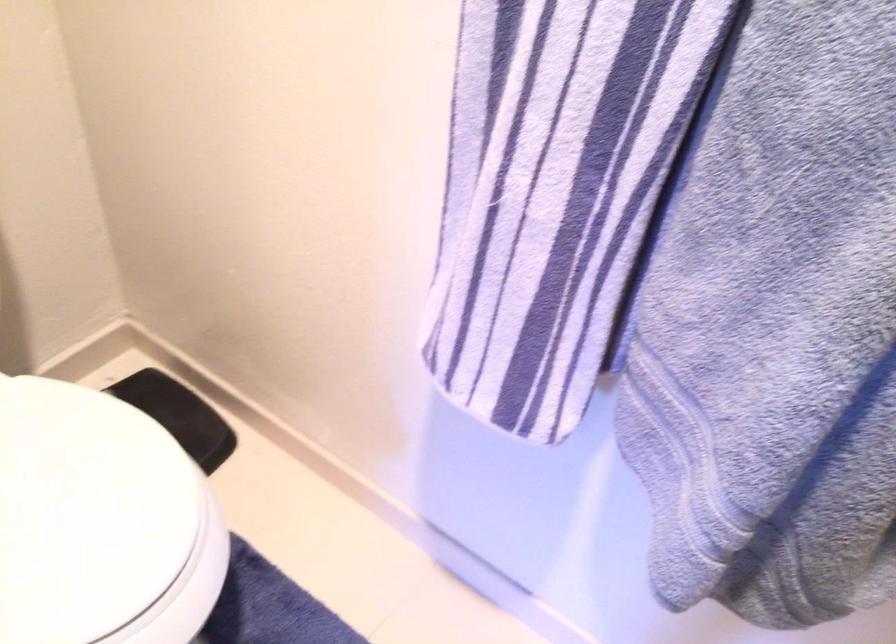
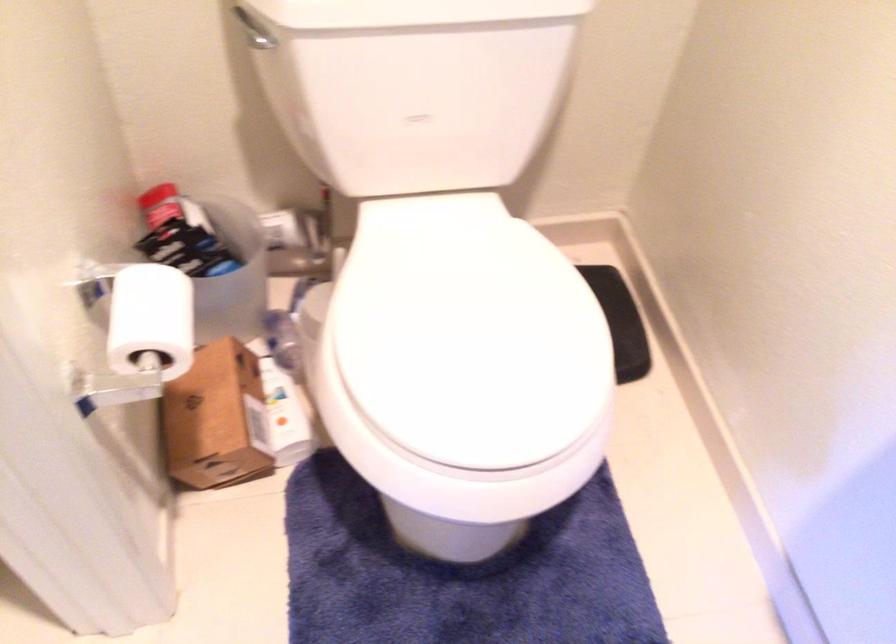
Question: The images are taken continuously from a first-person perspective. In which direction is your viewpoint rotating?

Choices:
 (A) Left
 (B) Right
 (C) Up
 (D) Down

Answer: (A)